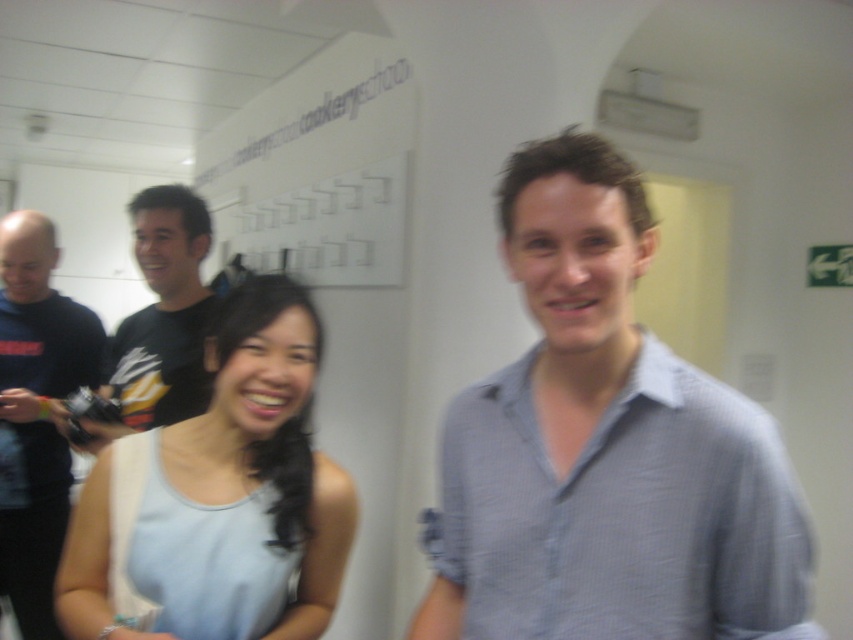
You are standing in the room and see the point at coordinates (604, 449). Which object is this point located on?

The point at coordinates (604, 449) is located on the light blue checkered shirt at center.